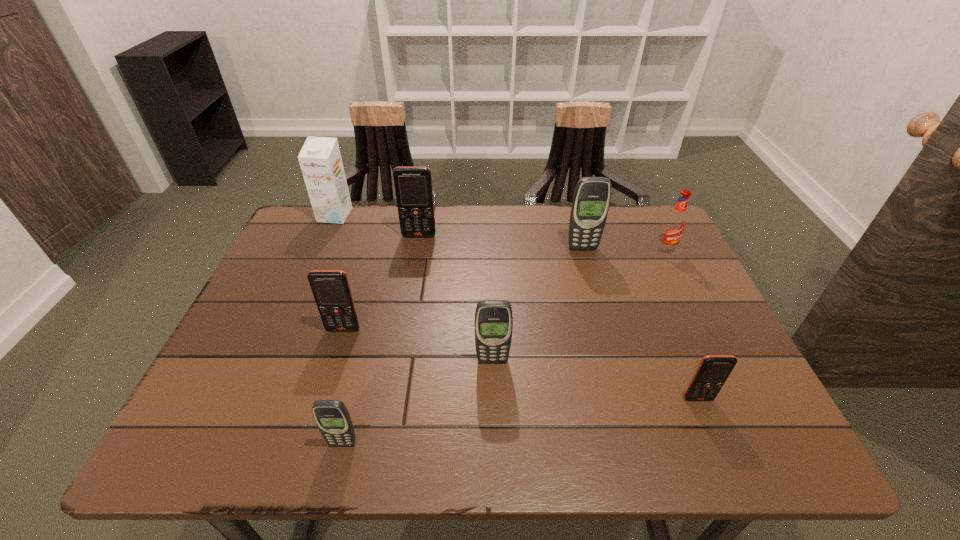
This screenshot has height=540, width=960. Find the location of `object at the far right corner`. object at the far right corner is located at coordinates (674, 225).

In the image, there is a desktop. Identify the location of vacant space at the far edge. (460, 245).

In the image, there is a desktop. Where is `free space at the near edge`? Image resolution: width=960 pixels, height=540 pixels. free space at the near edge is located at coordinates (624, 458).

Where is `free space at the left edge of the desktop`? This screenshot has height=540, width=960. free space at the left edge of the desktop is located at coordinates (274, 300).

You are a GUI agent. You are given a task and a screenshot of the screen. Output one action in this format:
    pyautogui.click(x=<x>, y=<y>)
    Task: Click on the blank space at the right edge of the desktop
    The image size is (960, 540).
    Given the screenshot: What is the action you would take?
    pyautogui.click(x=683, y=332)

The width and height of the screenshot is (960, 540). I want to click on vacant region at the near right corner of the desktop, so click(x=706, y=424).

I want to click on blank region between the second cellular telephone from right to left and the biggest orange cellular telephone, so click(x=501, y=242).

Identify the location of free area in between the biggest orange cellular telephone and the nearest gray cellular telephone. pos(381,340).

I want to click on free space between the second smallest orange cellular telephone and the sixth object from left to right, so click(463, 289).

Image resolution: width=960 pixels, height=540 pixels. I want to click on unoccupied area between the rightmost object and the fifth farthest cellular telephone, so click(682, 325).